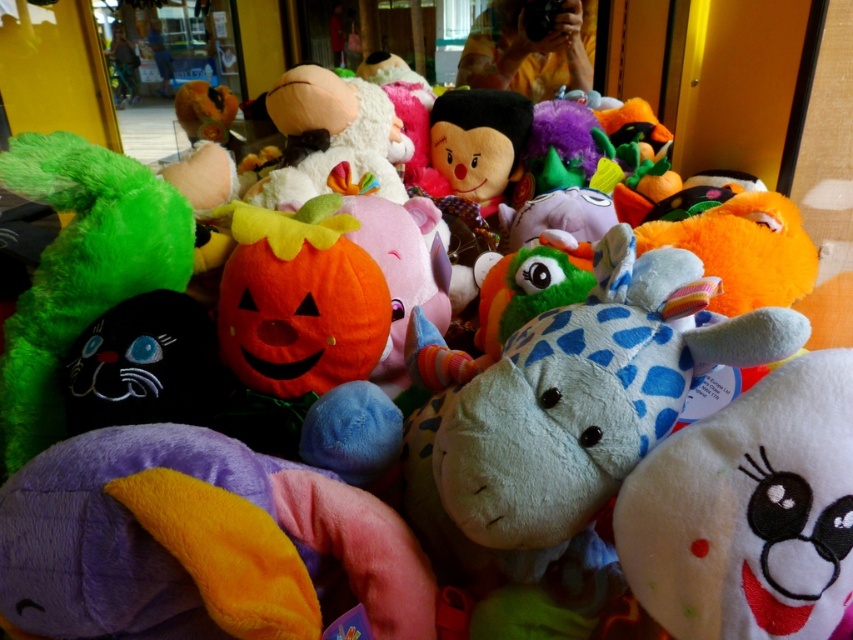
Does white soft plush at center have a larger size compared to fluffy plush pumpkin at center?

Incorrect, white soft plush at center is not larger than fluffy plush pumpkin at center.

This screenshot has height=640, width=853. I want to click on white soft plush at center, so click(747, 512).

Locate an element on the screen. The width and height of the screenshot is (853, 640). white soft plush at center is located at coordinates (747, 512).